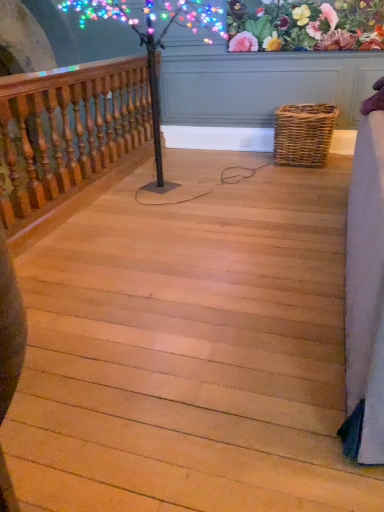
Question: Based on their sizes in the image, would you say woven brown picnic basket at lower right is bigger or smaller than light wood stairs at center?

Choices:
 (A) big
 (B) small

Answer: (B)

Question: In terms of width, does woven brown picnic basket at lower right look wider or thinner when compared to light wood stairs at center?

Choices:
 (A) thin
 (B) wide

Answer: (A)

Question: Based on their relative distances, which object is farther from the wooden baluster at left?

Choices:
 (A) floral fabric at upper center
 (B) woven brown picnic basket at lower right
 (C) light wood stairs at center

Answer: (A)

Question: Which object is positioned closest to the light wood stairs at center?

Choices:
 (A) floral fabric at upper center
 (B) woven brown picnic basket at lower right
 (C) wooden baluster at left

Answer: (C)